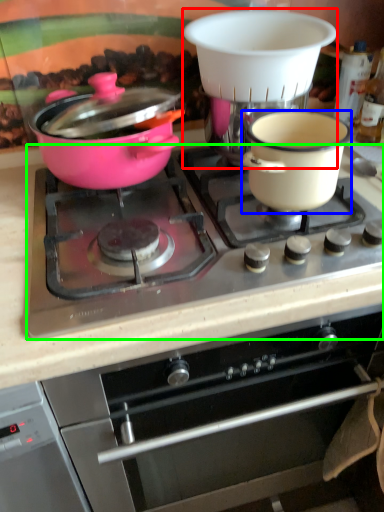
Question: Which object is the farthest from coffee machine (highlighted by a red box)? Choose among these: bowl (highlighted by a blue box) or gas stove (highlighted by a green box).

Choices:
 (A) bowl
 (B) gas stove

Answer: (B)